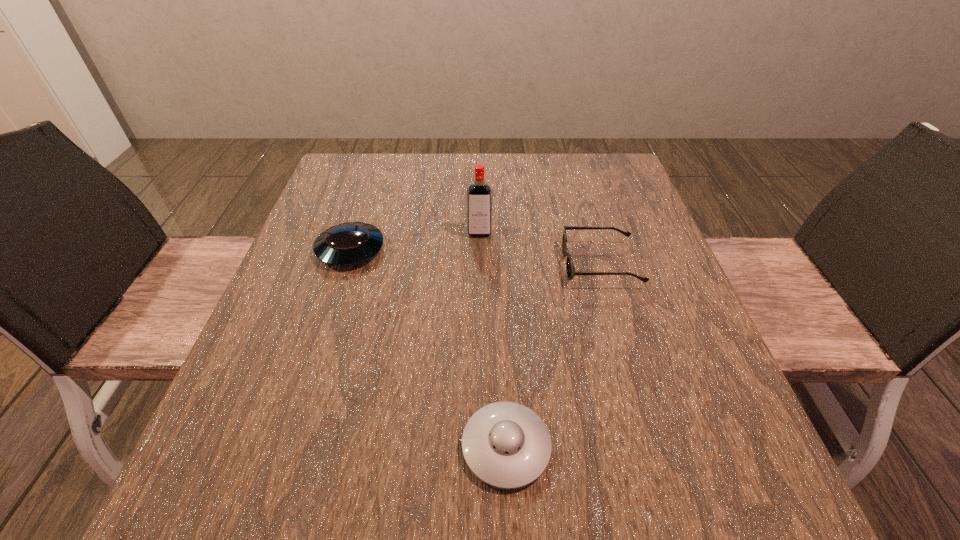
Identify the location of unoccupied position between the farther saucer and the right saucer. (428, 348).

Where is `vacant area that lies between the vodka and the leftmost object`? vacant area that lies between the vodka and the leftmost object is located at coordinates (415, 242).

This screenshot has width=960, height=540. I want to click on object that can be found as the second closest to the left saucer, so click(506, 445).

Choose which object is the second nearest neighbor to the vodka. Please provide its 2D coordinates. Your answer should be formatted as a tuple, i.e. [(x, y)], where the tuple contains the x and y coordinates of a point satisfying the conditions above.

[(351, 243)]

At what (x,y) coordinates should I click in order to perform the action: click on free space that satisfies the following two spatial constraints: 1. on the front and back of the tallest object; 2. on the right side of the nearest object. Please return your answer as a coordinate pair (x, y). The image size is (960, 540). Looking at the image, I should click on (479, 447).